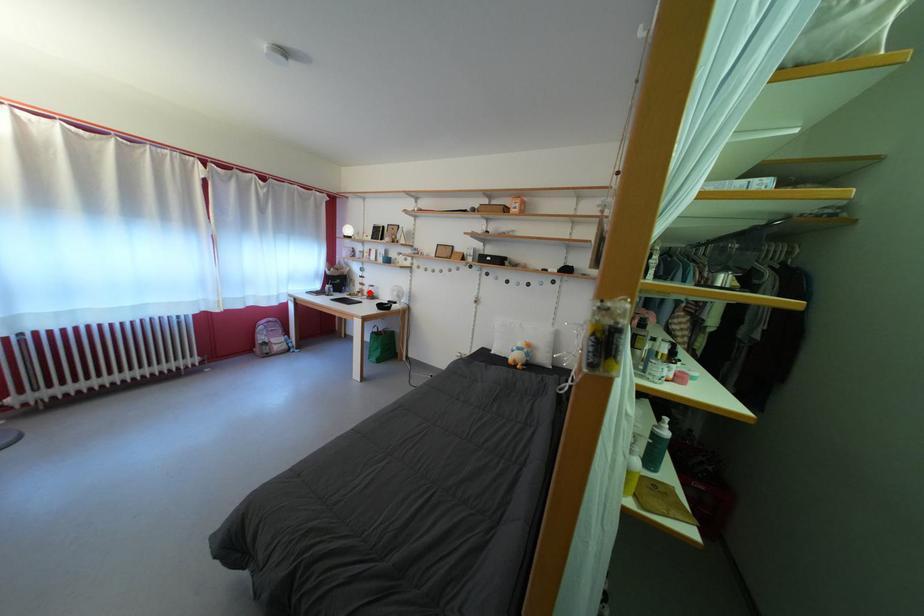
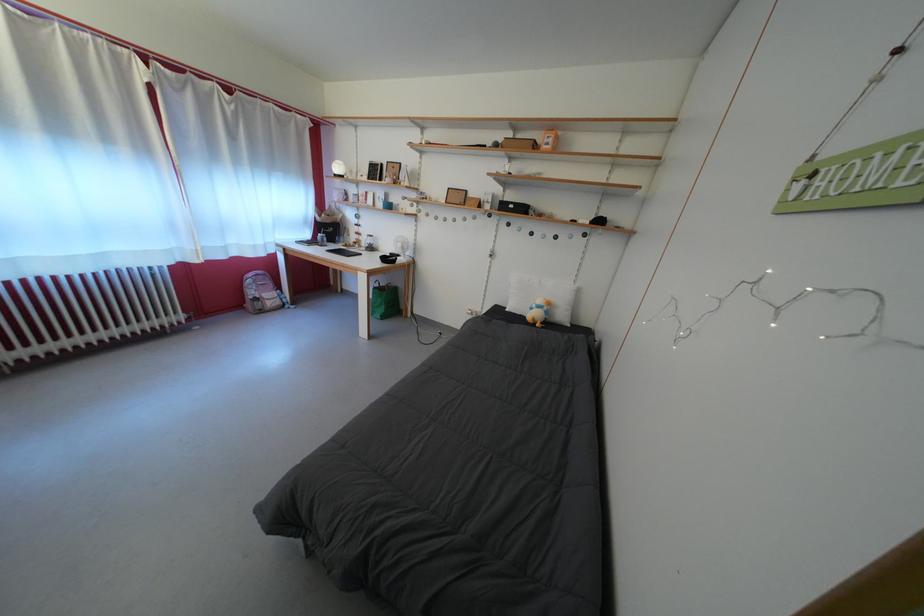
Question: I am providing you with two images of the same scene from different viewpoints. A red point is shown in image1. For the corresponding object point in image2, is it positioned nearer or farther from the camera?

Choices:
 (A) Nearer
 (B) Farther

Answer: (A)